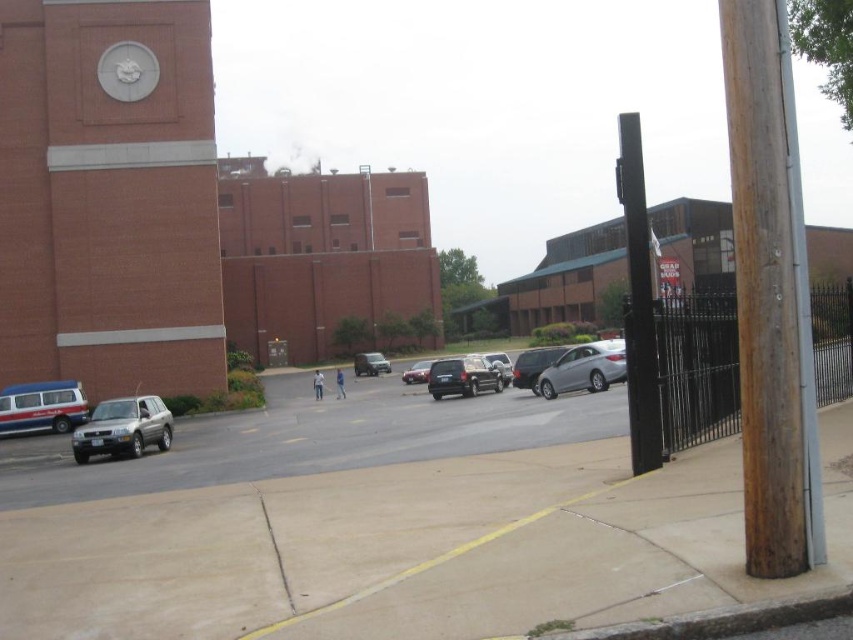
You are standing in the parking lot and want to walk towards the brick clock tower at upper left and the satin silver sedan at center. Which object will you reach first?

You will reach the brick clock tower at upper left first because it is closer to you than the satin silver sedan at center, which is further away.

Looking at this image, you are a delivery driver who needs to park your truck, which is 2 meters wide, in the parking lot. You see the black metal pole at right and the shiny black suv at center. Can you safely park your truck between them without hitting either?

The black metal pole at right might be wider than the shiny black suv at center, so it is uncertain if there is enough space. You should check the distance between them before deciding to park.